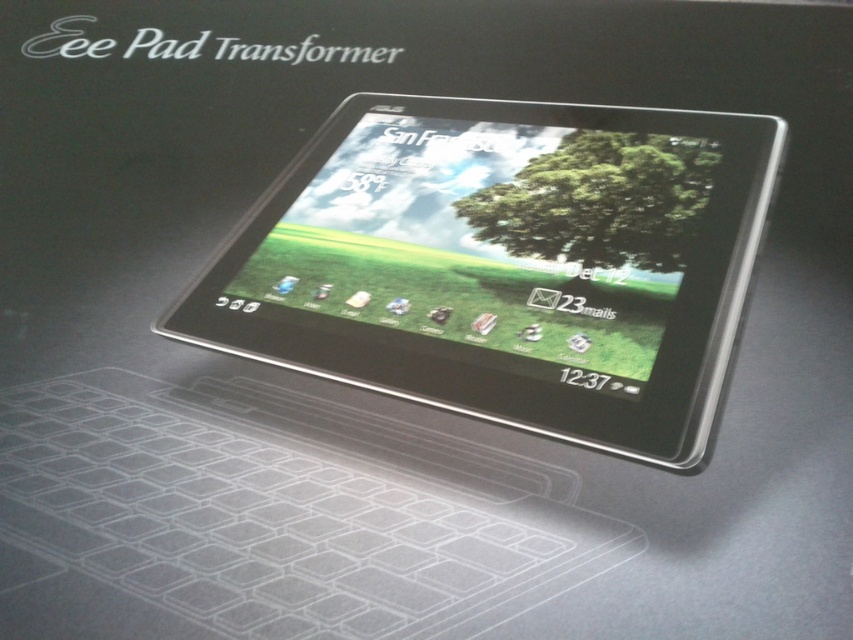
You are an engineer inspecting the Eee Pad Transformer display. You notice a specific point at coordinates (506,262). What object is located at that point?

The point at (506,262) is where the satin black tablet at center is located.

You are holding a smartphone and looking at the tablet displayed in the image. Which object is closer to you between the satin black tablet at center and the green matte tree at center?

The satin black tablet at center is closer to you as it is in front of the green matte tree at center.